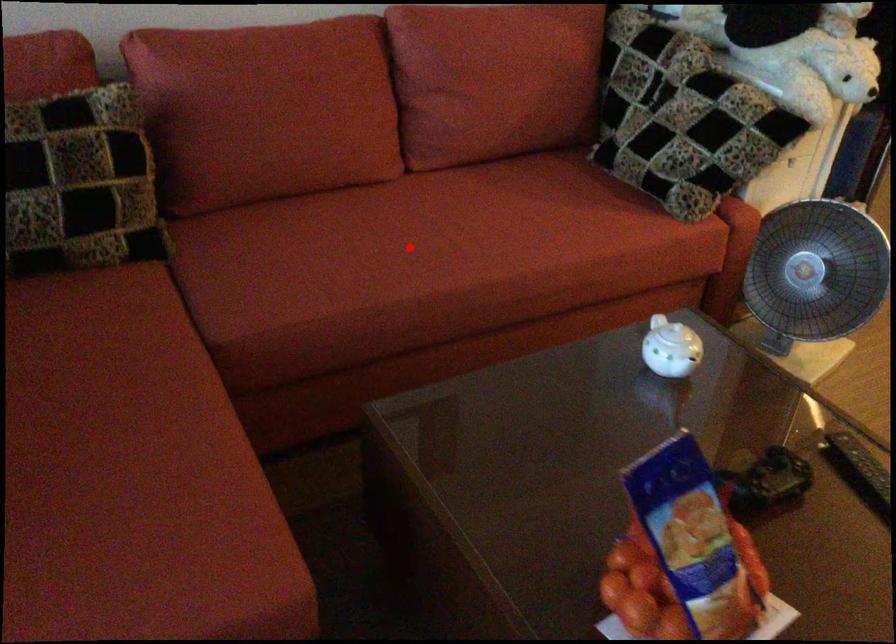
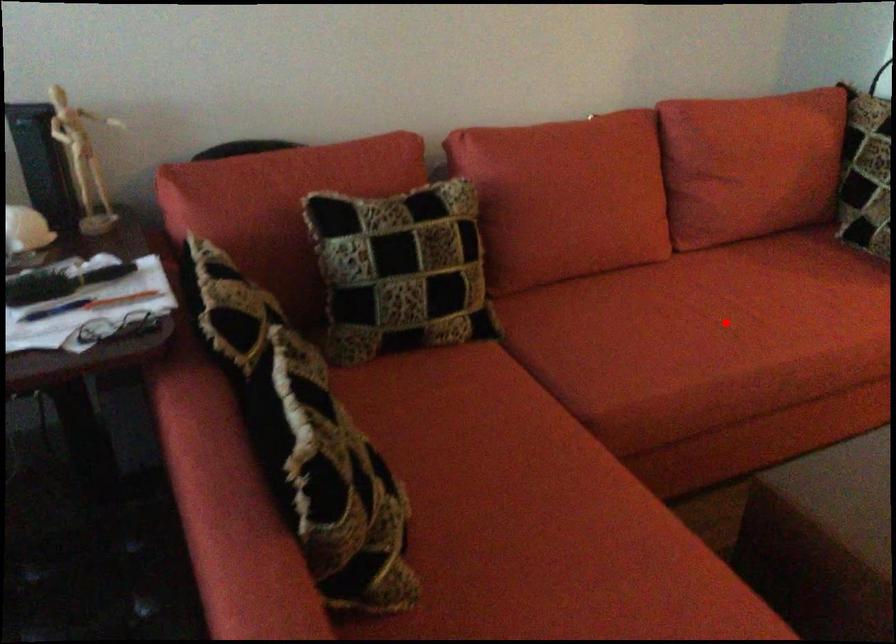
I am providing you with two images of the same scene from different viewpoints. A red point is marked on the first image and another point is marked on the second image. Is the marked point in image1 the same physical position as the marked point in image2?

Yes